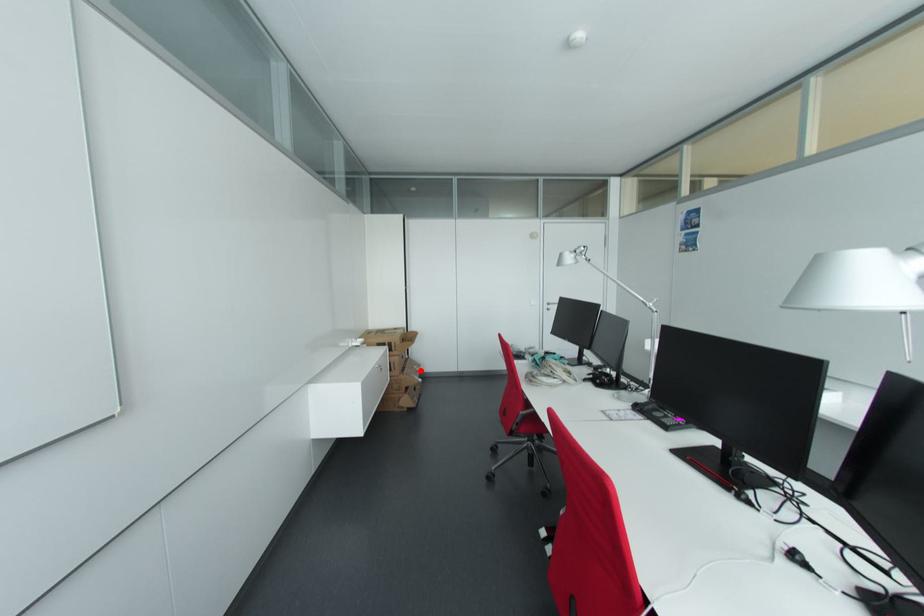
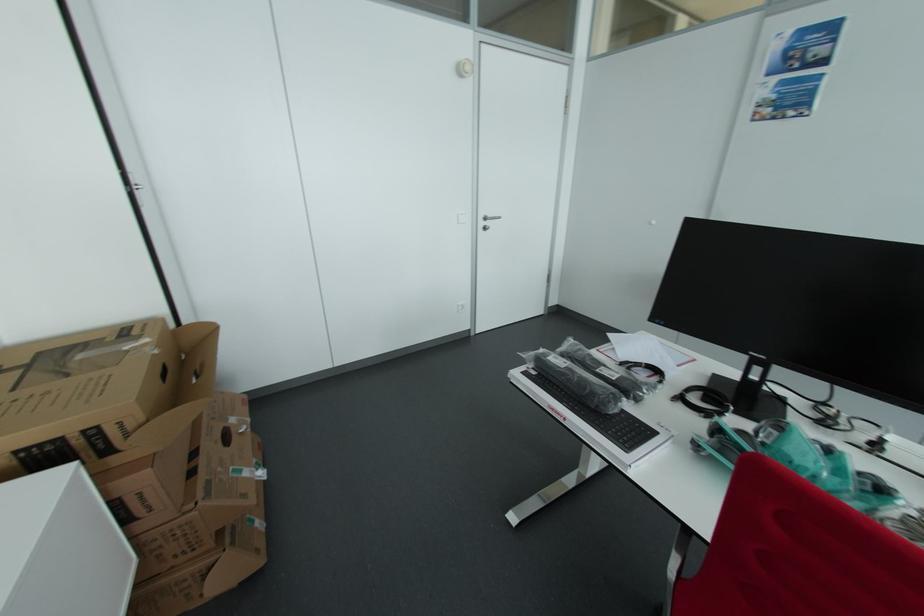
Find the pixel in the second image that matches the highlighted location in the first image.

(245, 432)